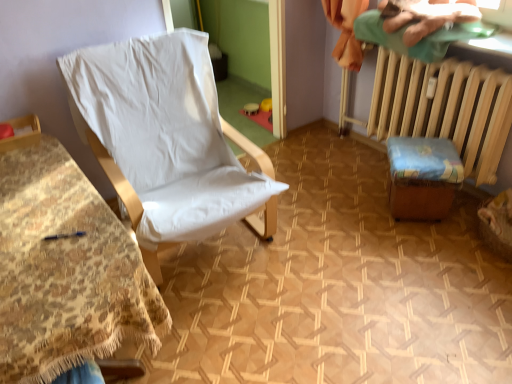
Find the location of a particular element. The image size is (512, 384). free spot below wooden radiator at right (from a real-world perspective) is located at coordinates (370, 152).